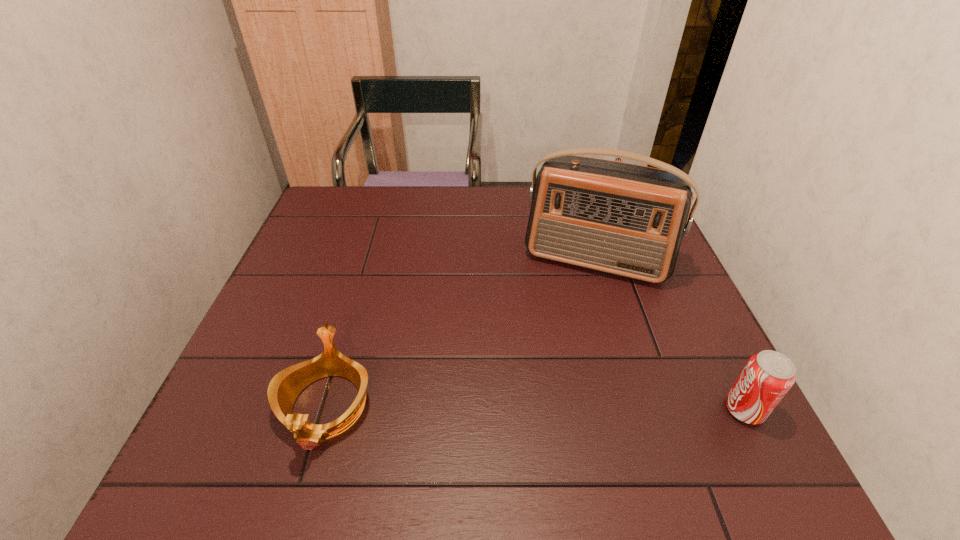
This screenshot has height=540, width=960. What are the coordinates of `the leftmost object` in the screenshot? It's located at (284, 388).

Locate an element on the screen. The height and width of the screenshot is (540, 960). soda can is located at coordinates (767, 376).

You are a GUI agent. You are given a task and a screenshot of the screen. Output one action in this format:
    pyautogui.click(x=<x>, y=<y>)
    Task: Click on the second farthest object
    Image resolution: width=960 pixels, height=540 pixels.
    Given the screenshot: What is the action you would take?
    pyautogui.click(x=625, y=219)

Where is `radio receiver`? This screenshot has width=960, height=540. radio receiver is located at coordinates (625, 219).

This screenshot has width=960, height=540. I want to click on the farthest object, so click(x=617, y=159).

Find the location of a particular element. The width and height of the screenshot is (960, 540). free space located 0.260m on the logo side of the soda can is located at coordinates (592, 409).

Where is `vacant space located 0.090m on the logo side of the soda can`? The image size is (960, 540). vacant space located 0.090m on the logo side of the soda can is located at coordinates (679, 409).

The width and height of the screenshot is (960, 540). In order to click on vacant space situated on the logo side of the soda can in this screenshot , I will do `click(557, 409)`.

Where is `vacant space located on the front-facing side of the radio receiver`? The width and height of the screenshot is (960, 540). vacant space located on the front-facing side of the radio receiver is located at coordinates point(558,356).

At what (x,y) coordinates should I click in order to perform the action: click on free space located 0.310m on the front-facing side of the radio receiver. Please return your answer as a coordinate pair (x, y). The width and height of the screenshot is (960, 540). Looking at the image, I should click on (548, 385).